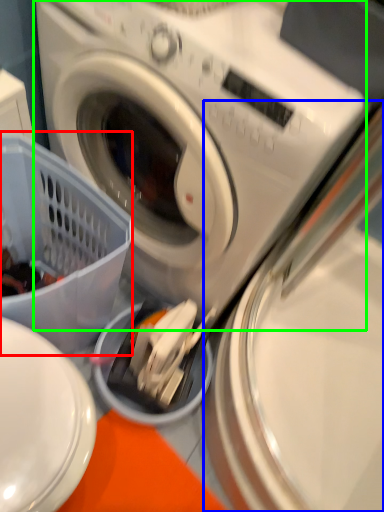
Question: Estimate the real-world distances between objects in this image. Which object is farther from basket (highlighted by a red box), washing machine (highlighted by a blue box) or washing machine (highlighted by a green box)?

Choices:
 (A) washing machine
 (B) washing machine

Answer: (A)